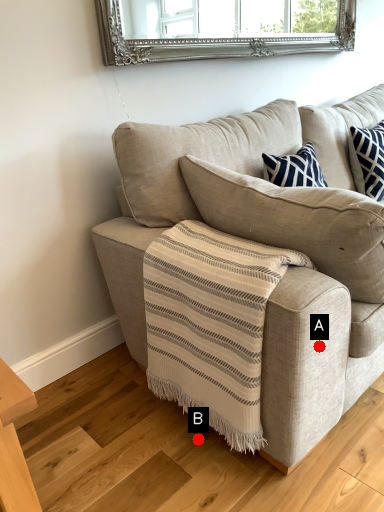
Question: Two points are circled on the image, labeled by A and B beside each circle. Which point appears farthest from the camera in this image?

Choices:
 (A) A is further
 (B) B is further

Answer: (B)